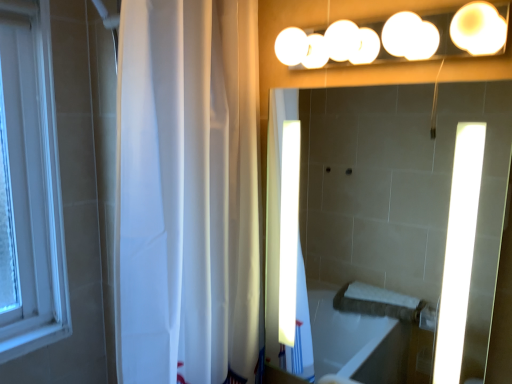
Locate an element on the screen. white sheer curtain at left is located at coordinates (184, 195).

The width and height of the screenshot is (512, 384). Find the location of `white glossy lights at upper center`. white glossy lights at upper center is located at coordinates (398, 37).

Where is `white glossy mirror at upper center`? The height and width of the screenshot is (384, 512). white glossy mirror at upper center is located at coordinates (400, 190).

In order to click on fixture located on the right of white sheer curtain at left in this screenshot , I will do `click(398, 37)`.

Considering the sizes of objects white glossy lights at upper center and white sheer curtain at left in the image provided, who is bigger, white glossy lights at upper center or white sheer curtain at left?

With larger size is white sheer curtain at left.

Is white glossy lights at upper center not close to white sheer curtain at left?

No, there isn't a large distance between white glossy lights at upper center and white sheer curtain at left.

Is point (369, 43) farther from camera compared to point (168, 19)?

Yes, point (369, 43) is farther from viewer.

Looking at their sizes, would you say white sheer curtain at left is wider or thinner than white glossy lights at upper center?

Clearly, white sheer curtain at left has more width compared to white glossy lights at upper center.

The image size is (512, 384). In order to click on fixture in front of the white sheer curtain at left in this screenshot , I will do `click(398, 37)`.

Consider the image. Is white sheer curtain at left oriented away from white glossy lights at upper center?

No, white sheer curtain at left is not facing the opposite direction of white glossy lights at upper center.

How far apart are white glossy mirror at upper center and white glossy lights at upper center?

5.53 feet.

Is white glossy mirror at upper center with white glossy lights at upper center?

white glossy mirror at upper center and white glossy lights at upper center are clearly separated.

Between white glossy mirror at upper center and white glossy lights at upper center, which one is positioned in front?

white glossy lights at upper center.

Find the location of a particular element. mirror on the right of white glossy lights at upper center is located at coordinates pos(400,190).

Does point (475, 13) come behind point (504, 175)?

No, (475, 13) is in front of (504, 175).

Would you consider white glossy lights at upper center to be distant from white glossy mirror at upper center?

white glossy lights at upper center is positioned a significant distance from white glossy mirror at upper center.

Based on the photo, can you confirm if white glossy lights at upper center is smaller than white glossy mirror at upper center?

Indeed, white glossy lights at upper center has a smaller size compared to white glossy mirror at upper center.

Is white sheer curtain at left turned away from white glossy mirror at upper center?

No, white sheer curtain at left is not facing away from white glossy mirror at upper center.

Can you confirm if white sheer curtain at left is thinner than white glossy mirror at upper center?

No.

From a real-world perspective, who is located higher, white sheer curtain at left or white glossy mirror at upper center?

From a 3D spatial view, white sheer curtain at left is above.

Is white glossy mirror at upper center next to white sheer curtain at left?

white glossy mirror at upper center and white sheer curtain at left are clearly separated.

Is white glossy mirror at upper center facing towards white sheer curtain at left?

No, white glossy mirror at upper center does not turn towards white sheer curtain at left.

Who is smaller, white glossy mirror at upper center or white sheer curtain at left?

white glossy mirror at upper center is smaller.

Is white glossy mirror at upper center at the right side of white sheer curtain at left?

Indeed, white glossy mirror at upper center is positioned on the right side of white sheer curtain at left.

Identify the location of shower curtain below the white glossy lights at upper center (from a real-world perspective). The height and width of the screenshot is (384, 512). (184, 195).

What are the coordinates of `shower curtain located below the white glossy lights at upper center (from the image's perspective)` in the screenshot? It's located at (184, 195).

In the scene shown: From the image, which object appears to be nearer to white glossy mirror at upper center, white glossy lights at upper center or white sheer curtain at left?

Among the two, white glossy lights at upper center is located nearer to white glossy mirror at upper center.

From the image, which object appears to be farther from white sheer curtain at left, white glossy lights at upper center or white glossy mirror at upper center?

Based on the image, white glossy mirror at upper center appears to be further to white sheer curtain at left.

From the image, which object appears to be nearer to white glossy lights at upper center, white sheer curtain at left or white glossy mirror at upper center?

white sheer curtain at left lies closer to white glossy lights at upper center than the other object.

Looking at the image, which one is located further to white glossy lights at upper center, white glossy mirror at upper center or white sheer curtain at left?

white glossy mirror at upper center lies further to white glossy lights at upper center than the other object.

When comparing their distances from white glossy mirror at upper center, does white sheer curtain at left or white glossy lights at upper center seem further?

white sheer curtain at left.

Looking at this image, looking at the image, which one is located further to white sheer curtain at left, white glossy mirror at upper center or white glossy lights at upper center?

white glossy mirror at upper center lies further to white sheer curtain at left than the other object.

Image resolution: width=512 pixels, height=384 pixels. In order to click on fixture located between white sheer curtain at left and white glossy mirror at upper center in the left-right direction in this screenshot , I will do `click(398, 37)`.